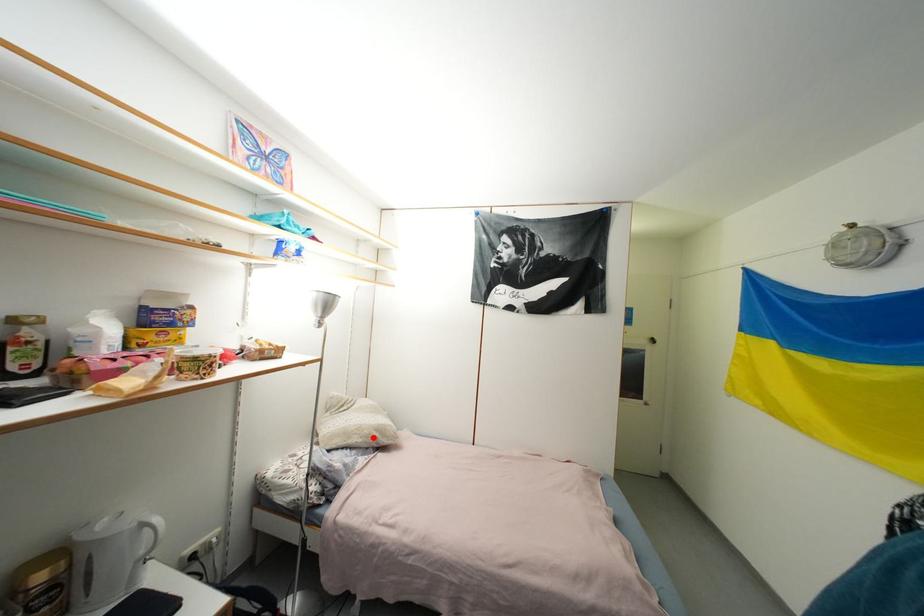
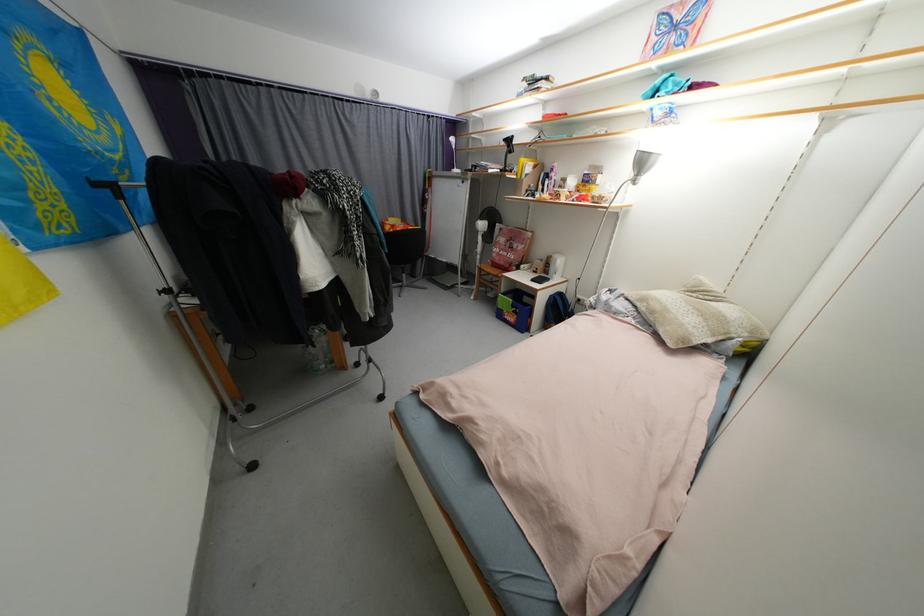
Question: I am providing you with two images of the same scene from different viewpoints. In image1, a red point is highlighted. Considering the same 3D point in image2, which of the following is correct?

Choices:
 (A) It is closer
 (B) It is farther

Answer: (A)